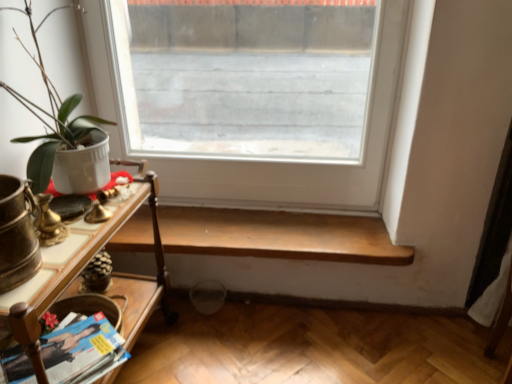
Measure the distance between point (47,86) and camera.

4.54 feet.

Image resolution: width=512 pixels, height=384 pixels. What do you see at coordinates (82, 351) in the screenshot?
I see `matte paper magazine at lower left` at bounding box center [82, 351].

You are a GUI agent. You are given a task and a screenshot of the screen. Output one action in this format:
    pyautogui.click(x=<x>, y=<y>)
    Task: Click on the matte paper magazine at lower left
    This screenshot has width=512, height=384.
    Given the screenshot: What is the action you would take?
    pyautogui.click(x=82, y=351)

What do you see at coordinates (279, 235) in the screenshot? This screenshot has width=512, height=384. I see `wooden shelf at lower center` at bounding box center [279, 235].

Identify the location of matte white pot at left. (51, 113).

Which is behind, point (307, 184) or point (67, 122)?

Point (307, 184)

Is clear glass window at center oriented away from matte white pot at left?

No, clear glass window at center's orientation is not away from matte white pot at left.

Is matte white pot at left a part of clear glass window at center?

No.

Is matte paper magazine at lower left positioned far away from matte white pot at left?

Actually, matte paper magazine at lower left and matte white pot at left are a little close together.

From a real-world perspective, who is located higher, matte paper magazine at lower left or matte white pot at left?

matte white pot at left.

Between matte paper magazine at lower left and matte white pot at left, which one has more height?

Standing taller between the two is matte white pot at left.

From the image's perspective, relative to wooden shelf at lower center, is matte paper magazine at lower left above or below?

From the image's perspective, matte paper magazine at lower left appears below wooden shelf at lower center.

Looking at their sizes, would you say matte paper magazine at lower left is wider or thinner than wooden shelf at lower center?

In the image, matte paper magazine at lower left appears to be wider than wooden shelf at lower center.

Does matte paper magazine at lower left turn towards wooden shelf at lower center?

No.

Measure the distance between wooden table at left and clear glass window at center.

The distance of wooden table at left from clear glass window at center is 19.70 inches.

In the scene shown: Considering the sizes of objects wooden table at left and clear glass window at center in the image provided, who is taller, wooden table at left or clear glass window at center?

With more height is clear glass window at center.

How many degrees apart are the facing directions of wooden table at left and clear glass window at center?

They differ by 84.6 degrees in their facing directions.

From the image's perspective, would you say wooden table at left is positioned over clear glass window at center?

No, from the image's perspective, wooden table at left is not on top of clear glass window at center.

Could you tell me if matte white pot at left is facing clear glass window at center?

No, matte white pot at left is not oriented towards clear glass window at center.

Is point (51, 127) closer to viewer compared to point (377, 37)?

That is True.

Which is more to the left, matte white pot at left or clear glass window at center?

matte white pot at left.

The image size is (512, 384). Find the location of `houseplant in front of the clear glass window at center`. houseplant in front of the clear glass window at center is located at coordinates (51, 113).

From the image's perspective, between wooden table at left and matte paper magazine at lower left, which one is located above?

From the image's view, wooden table at left is above.

Which is farther, (157, 224) or (66, 352)?

Positioned behind is point (157, 224).

Looking at this image, is wooden table at left located outside matte paper magazine at lower left?

wooden table at left is positioned outside matte paper magazine at lower left.

Can you confirm if wooden table at left is positioned to the right of matte paper magazine at lower left?

Yes.

Considering the sizes of objects clear glass window at center and wooden shelf at lower center in the image provided, who is thinner, clear glass window at center or wooden shelf at lower center?

clear glass window at center.

Does clear glass window at center come behind wooden shelf at lower center?

No, the depth of clear glass window at center is less than that of wooden shelf at lower center.

From the image's perspective, relative to wooden shelf at lower center, is clear glass window at center above or below?

From the image's perspective, clear glass window at center appears above wooden shelf at lower center.

Is clear glass window at center inside the boundaries of wooden shelf at lower center, or outside?

clear glass window at center exists outside the volume of wooden shelf at lower center.

Where is `houseplant in front of the clear glass window at center`? This screenshot has height=384, width=512. houseplant in front of the clear glass window at center is located at coordinates (51, 113).

Where is `houseplant that appears above the matte paper magazine at lower left (from a real-world perspective)`? Image resolution: width=512 pixels, height=384 pixels. houseplant that appears above the matte paper magazine at lower left (from a real-world perspective) is located at coordinates (51, 113).

When comparing their distances from matte white pot at left, does matte paper magazine at lower left or wooden table at left seem closer?

Based on the image, wooden table at left appears to be nearer to matte white pot at left.

Estimate the real-world distances between objects in this image. Which object is closer to matte white pot at left, matte paper magazine at lower left or wooden shelf at lower center?

The object closer to matte white pot at left is matte paper magazine at lower left.

Which object lies further to the anchor point wooden shelf at lower center, wooden table at left or matte paper magazine at lower left?

matte paper magazine at lower left is further to wooden shelf at lower center.

Looking at the image, which one is located closer to wooden table at left, matte white pot at left or clear glass window at center?

The object closer to wooden table at left is matte white pot at left.

Which object lies nearer to the anchor point wooden table at left, wooden shelf at lower center or clear glass window at center?

wooden shelf at lower center is closer to wooden table at left.

Which object lies nearer to the anchor point wooden table at left, wooden shelf at lower center or matte white pot at left?

matte white pot at left lies closer to wooden table at left than the other object.

Looking at the image, which one is located closer to clear glass window at center, wooden shelf at lower center or wooden table at left?

wooden shelf at lower center is positioned closer to the anchor clear glass window at center.

When comparing their distances from wooden table at left, does wooden shelf at lower center or matte paper magazine at lower left seem closer?

matte paper magazine at lower left.

What are the coordinates of `houseplant between clear glass window at center and matte paper magazine at lower left in the vertical direction` in the screenshot? It's located at (51, 113).

Where is `window between wooden table at left and wooden shelf at lower center from front to back`? This screenshot has height=384, width=512. window between wooden table at left and wooden shelf at lower center from front to back is located at coordinates tap(249, 158).

The image size is (512, 384). I want to click on magazine between wooden table at left and wooden shelf at lower center from front to back, so click(x=82, y=351).

What are the coordinates of `window between matte white pot at left and wooden shelf at lower center in the front-back direction` in the screenshot? It's located at (249, 158).